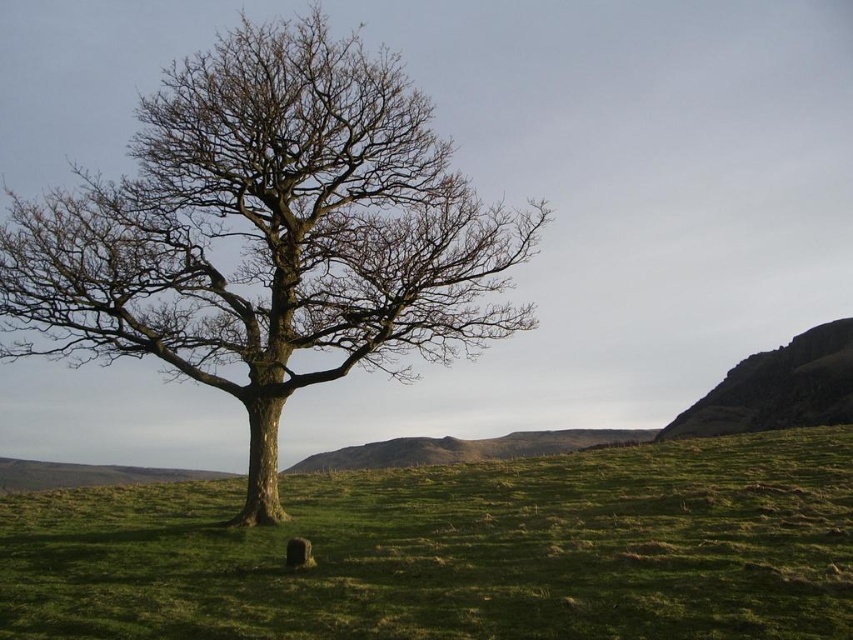
Question: Does green grassy field at center appear on the right side of rugged stone hillside at right?

Choices:
 (A) no
 (B) yes

Answer: (A)

Question: Which object is farther from the camera taking this photo?

Choices:
 (A) green grassy field at center
 (B) rugged stone hillside at right

Answer: (B)

Question: Among these points, which one is nearest to the camera?

Choices:
 (A) (645, 612)
 (B) (683, 435)

Answer: (A)

Question: Based on their relative distances, which object is farther from the smooth bark tree at center?

Choices:
 (A) green grassy field at center
 (B) rugged stone hillside at right

Answer: (B)

Question: Can you confirm if smooth bark tree at center is smaller than rugged stone hillside at right?

Choices:
 (A) yes
 (B) no

Answer: (B)

Question: Observing the image, what is the correct spatial positioning of green grassy field at center in reference to smooth bark tree at center?

Choices:
 (A) left
 (B) right

Answer: (B)